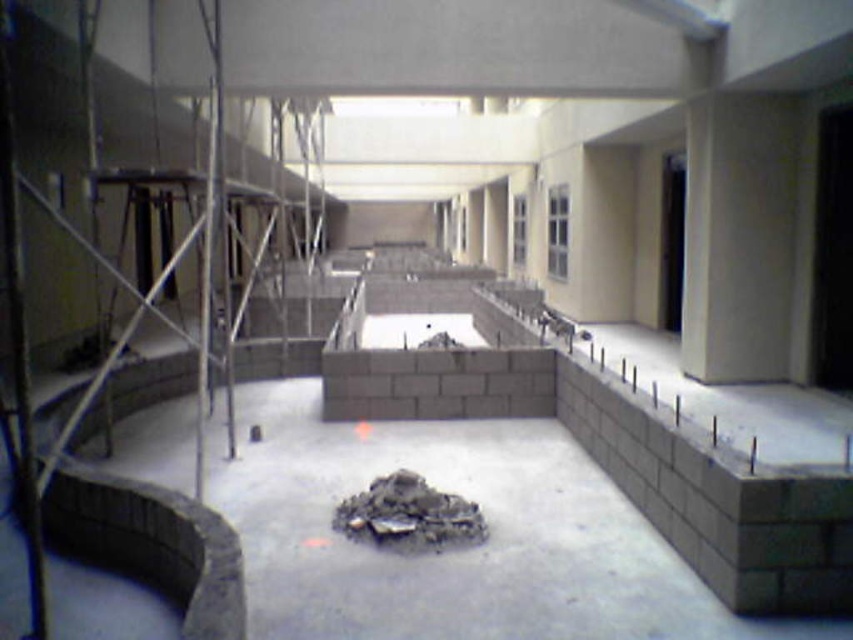
You are a construction worker carrying a heavy tool. You need to move from the entrance to the metal scaffolding at left without stepping on the gray concrete block at center. Is there enough space to walk around it?

The metal scaffolding at left is bigger than the gray concrete block at center, so there is enough space to walk around the gray concrete block at center and reach the metal scaffolding at left.

You are a construction worker standing at the point labeled point (x=44, y=88). You need to move to the nearest column to secure a safety harness. Which direction should you walk to reach the nearest column?

The point (x=44, y=88) corresponds to metal scaffolding at left, so you should walk towards the nearest column located to the right of the scaffolding to secure the harness.

You are a construction worker needing to move a heavy tool from the entrance to the gray concrete block at center. There is metal scaffolding at left blocking the path. Can you move the tool directly to the block without going around the scaffolding?

The metal scaffolding at left is to the left of the gray concrete block at center, so the scaffolding is not blocking the path directly to the block. You can move the tool directly to the gray concrete block at center without needing to go around.